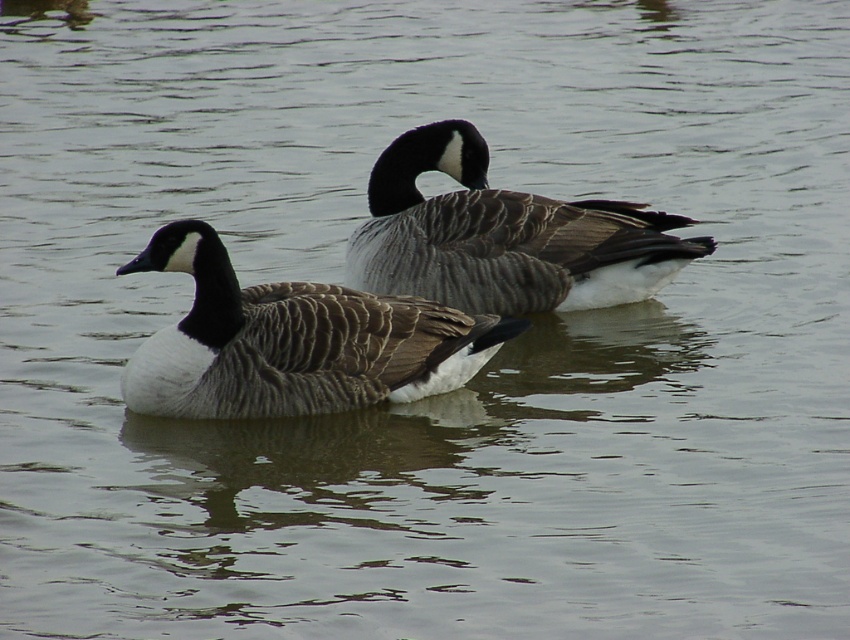
You are a wildlife researcher observing two Canada geese on a lake. You need to place a small sensor buoy between them to monitor water quality. The buoy has a diameter of 0.5 meters. Can you safely place the buoy between the brown textured goose at left and the gray feathered goose at center without it being too close to either bird?

The distance between the brown textured goose at left and the gray feathered goose at center is 1.60 meters. The buoy requires a space of at least 0.5 meters in diameter. Since the distance between them is greater than the buoy size, you can safely place the buoy between them, ensuring it stays centered and away from both geese.

From the picture: You are a birdwatcher observing the two Canada geese in the image. Based on their positions, which goose is closer to you, the brown textured goose at left or the gray feathered goose at center?

The brown textured goose at left is closer to you because it is positioned in front of the gray feathered goose at center.

You are a wildlife photographer trying to capture a clear photo of both the brown textured goose at left and the gray feathered goose at center. However, you notice that one of them is partially hidden. Which goose is more visible in the photo?

The gray feathered goose at center is more visible because the brown textured goose at left is positioned under it, partially blocking the view.